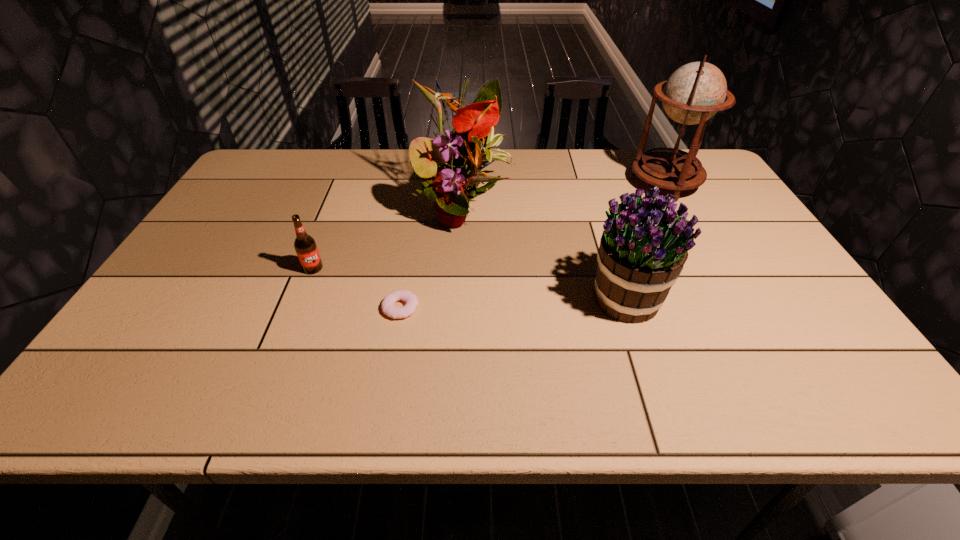
The image size is (960, 540). Find the location of `vacant space at the near edge`. vacant space at the near edge is located at coordinates (739, 400).

Where is `vacant space at the right edge`? vacant space at the right edge is located at coordinates (708, 211).

Find the location of a particular element. vacant area at the near left corner is located at coordinates (94, 392).

Where is `free spot between the root beer and the shorter bouquet`? free spot between the root beer and the shorter bouquet is located at coordinates (468, 284).

Find the location of a particular element. The image size is (960, 540). empty space between the shortest object and the rightmost object is located at coordinates (533, 245).

You are a GUI agent. You are given a task and a screenshot of the screen. Output one action in this format:
    pyautogui.click(x=<x>, y=<y>)
    Task: Click on the empty space that is in between the leftmost object and the shorter bouquet
    The image size is (960, 540).
    Given the screenshot: What is the action you would take?
    pyautogui.click(x=468, y=284)

The image size is (960, 540). In order to click on free spot between the fourth tallest object and the third shortest object in this screenshot , I will do `click(468, 284)`.

You are a GUI agent. You are given a task and a screenshot of the screen. Output one action in this format:
    pyautogui.click(x=<x>, y=<y>)
    Task: Click on the unoccupied position between the rightmost object and the farther bouquet
    The height and width of the screenshot is (540, 960).
    Given the screenshot: What is the action you would take?
    pyautogui.click(x=564, y=198)

Image resolution: width=960 pixels, height=540 pixels. Find the location of `vacant region between the shorter bouquet and the farther bouquet`. vacant region between the shorter bouquet and the farther bouquet is located at coordinates (543, 255).

Image resolution: width=960 pixels, height=540 pixels. I want to click on vacant area between the farther bouquet and the fourth object from left to right, so click(543, 255).